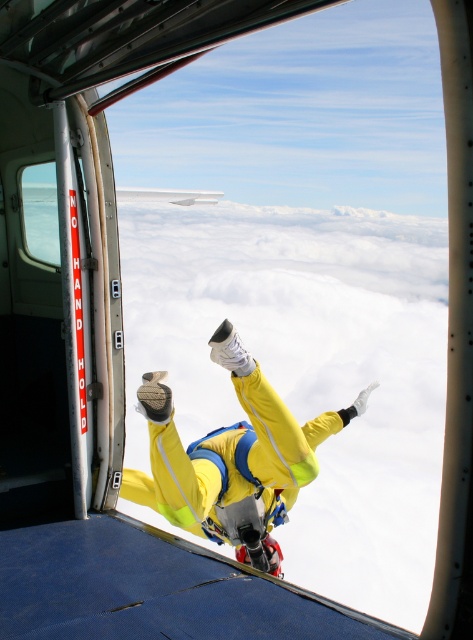
Which is more to the right, yellow fabric suit at center or transparent glass airplane window at left?

yellow fabric suit at center is more to the right.

Does yellow fabric suit at center appear on the left side of transparent glass airplane window at left?

In fact, yellow fabric suit at center is to the right of transparent glass airplane window at left.

Identify the location of yellow fabric suit at center. (231, 458).